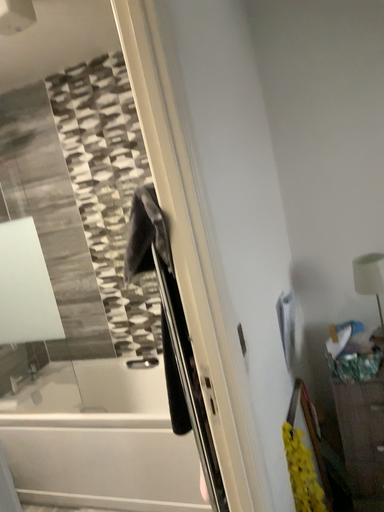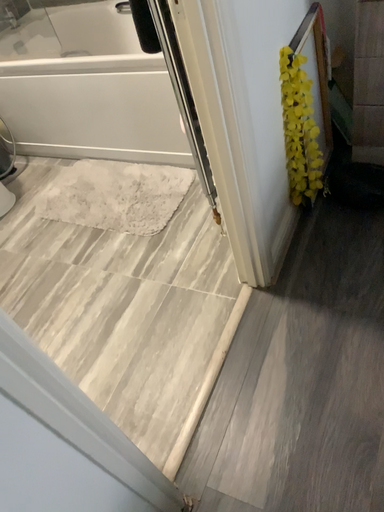
Question: How did the camera likely rotate when shooting the video?

Choices:
 (A) rotated downward
 (B) rotated upward

Answer: (A)